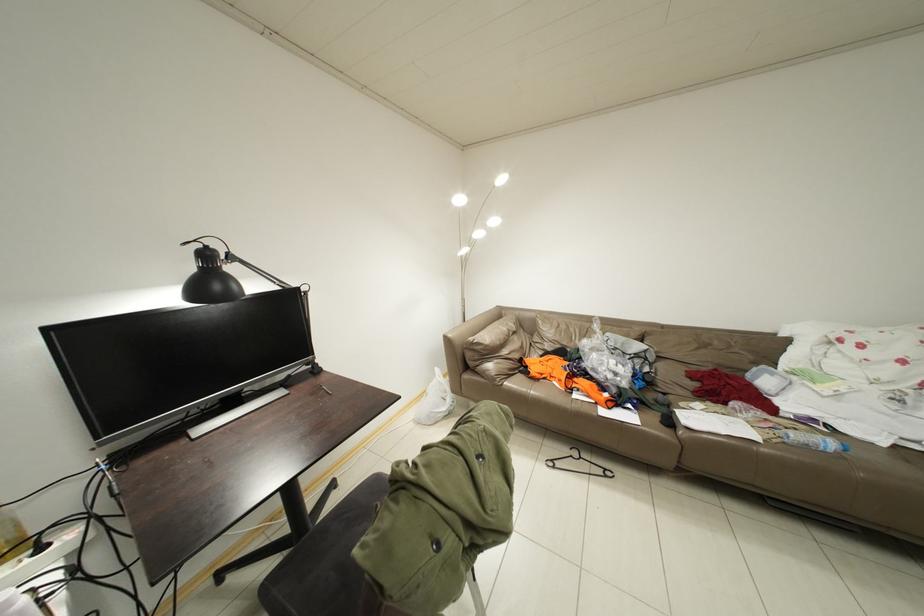
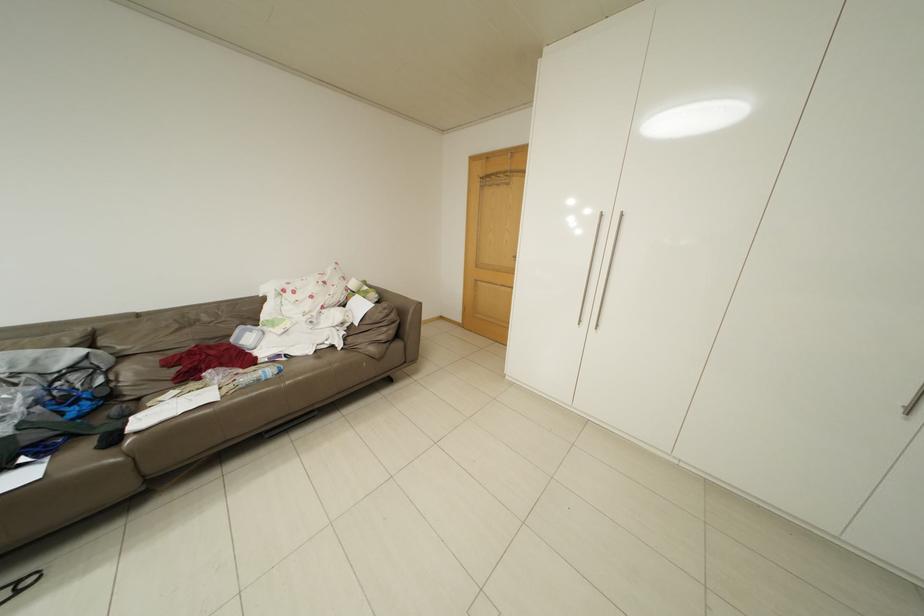
Question: The images are taken continuously from a first-person perspective. In which direction is your viewpoint rotating?

Choices:
 (A) Left
 (B) Right
 (C) Up
 (D) Down

Answer: (B)